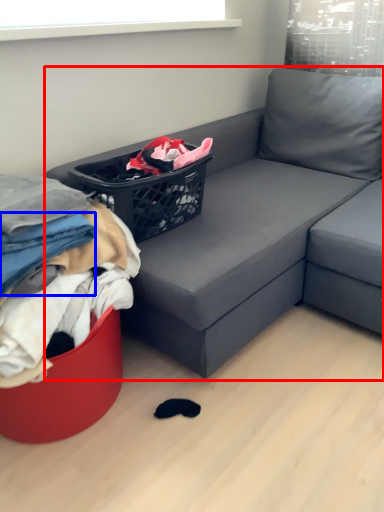
Question: Which of the following is the closest to the observer, studio couch (highlighted by a red box) or clothing (highlighted by a blue box)?

Choices:
 (A) studio couch
 (B) clothing

Answer: (A)